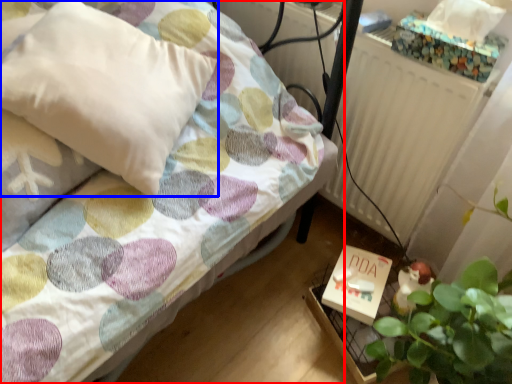
Question: Which of the following is the closest to the observer, bed (highlighted by a red box) or pillow (highlighted by a blue box)?

Choices:
 (A) bed
 (B) pillow

Answer: (A)